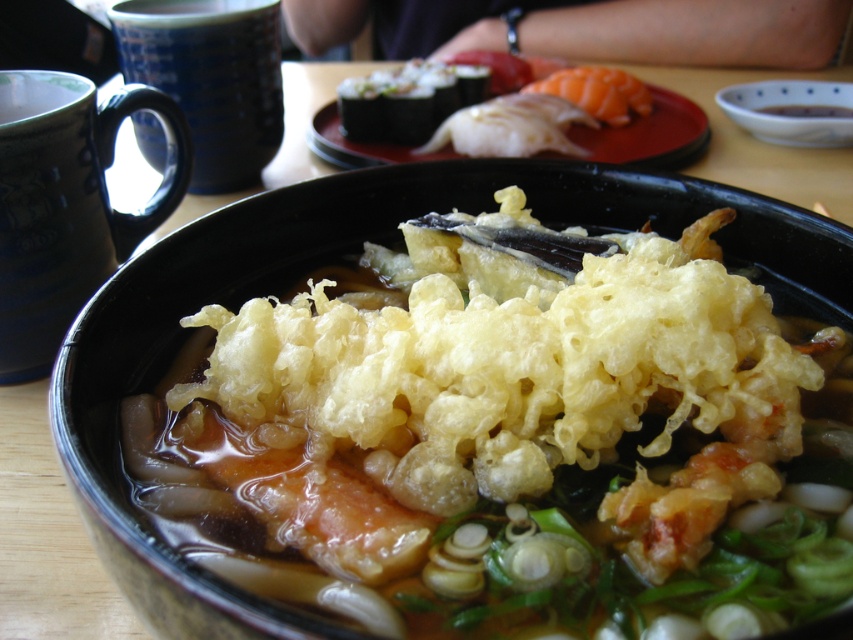
Question: Which of the following is the farthest from the observer?

Choices:
 (A) (355, 534)
 (B) (96, 116)

Answer: (B)

Question: Among these objects, which one is nearest to the camera?

Choices:
 (A) matte ceramic mug at upper left
 (B) blue ceramic mug at upper left

Answer: (A)

Question: Can you confirm if matte ceramic mug at upper left is positioned to the left of blue ceramic mug at upper left?

Choices:
 (A) no
 (B) yes

Answer: (B)

Question: Is matte ceramic mug at upper left wider than blue ceramic mug at upper left?

Choices:
 (A) yes
 (B) no

Answer: (B)

Question: Is matte ceramic mug at upper left below blue ceramic mug at upper left?

Choices:
 (A) yes
 (B) no

Answer: (A)

Question: Which point is farther to the camera?

Choices:
 (A) matte ceramic mug at upper left
 (B) golden crispy tempura at center
 (C) blue ceramic mug at upper left

Answer: (C)